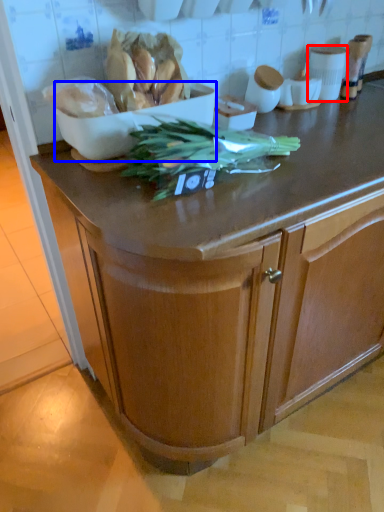
Question: Which of the following is the closest to the observer, appliance (highlighted by a red box) or bowl (highlighted by a blue box)?

Choices:
 (A) appliance
 (B) bowl

Answer: (B)